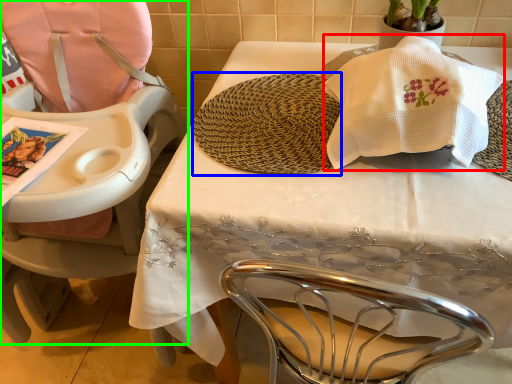
Question: Based on their relative distances, which object is farther from blanket (highlighted by a red box)? Choose from mat (highlighted by a blue box) and chair (highlighted by a green box).

Choices:
 (A) mat
 (B) chair

Answer: (B)